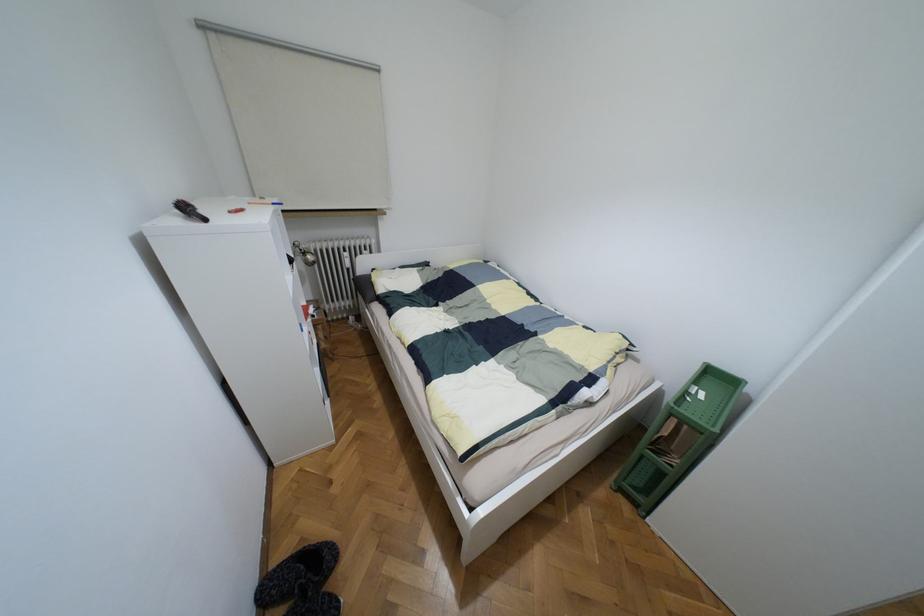
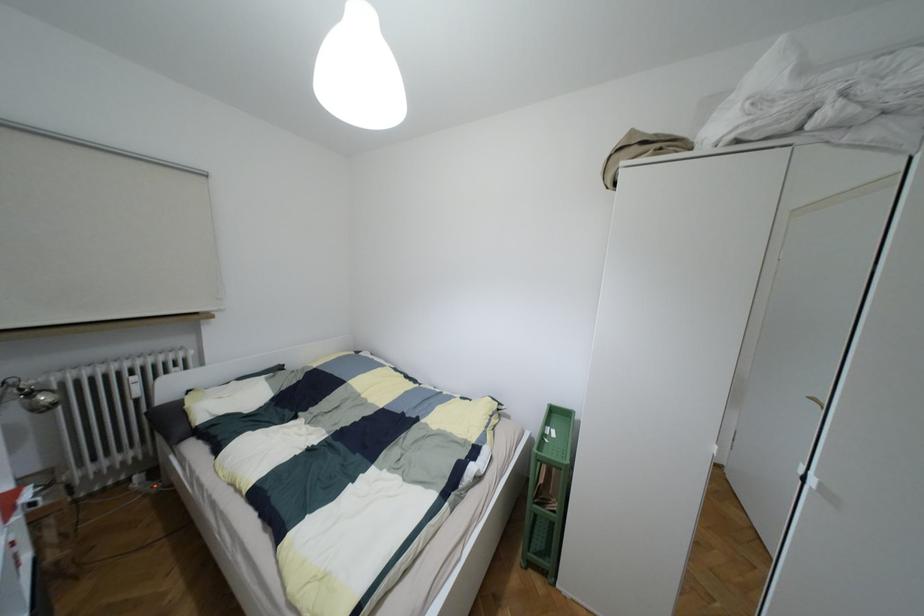
The point at (310,257) is marked in the first image. Where is the corresponding point in the second image?

(43, 397)